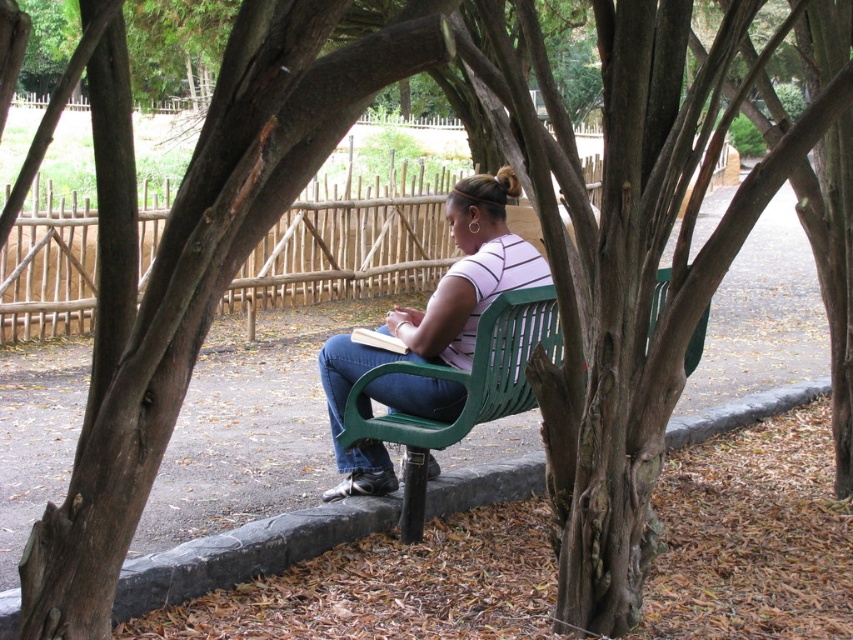
Question: Which of the following is the closest to the observer?

Choices:
 (A) green plastic bench at center
 (B) matte green bench at center

Answer: (A)

Question: Which object is closer to the camera taking this photo?

Choices:
 (A) green plastic bench at center
 (B) matte green bench at center

Answer: (A)

Question: Can you confirm if matte green bench at center is positioned to the left of green plastic bench at center?

Choices:
 (A) no
 (B) yes

Answer: (B)

Question: Can you confirm if matte green bench at center is thinner than green plastic bench at center?

Choices:
 (A) no
 (B) yes

Answer: (A)

Question: Does matte green bench at center lie in front of green plastic bench at center?

Choices:
 (A) no
 (B) yes

Answer: (A)